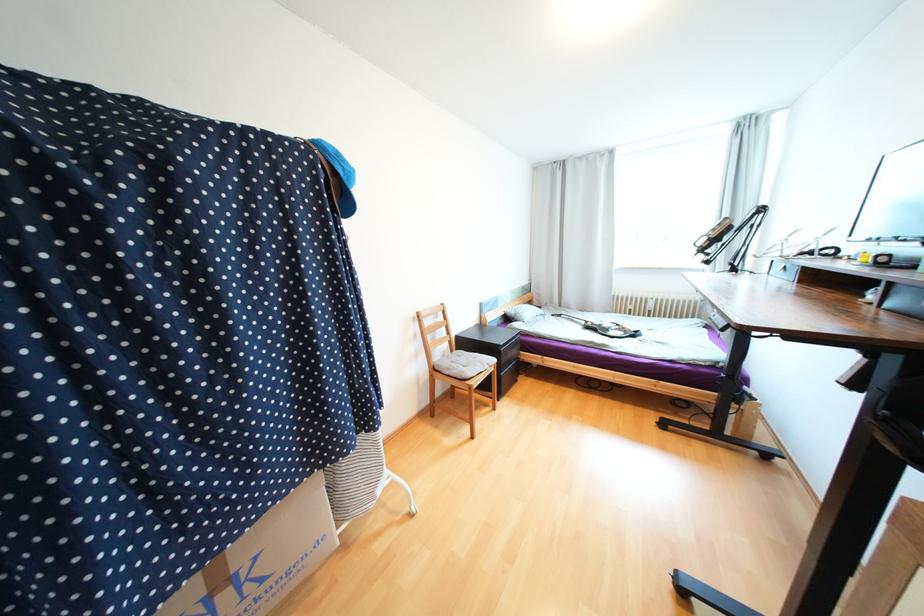
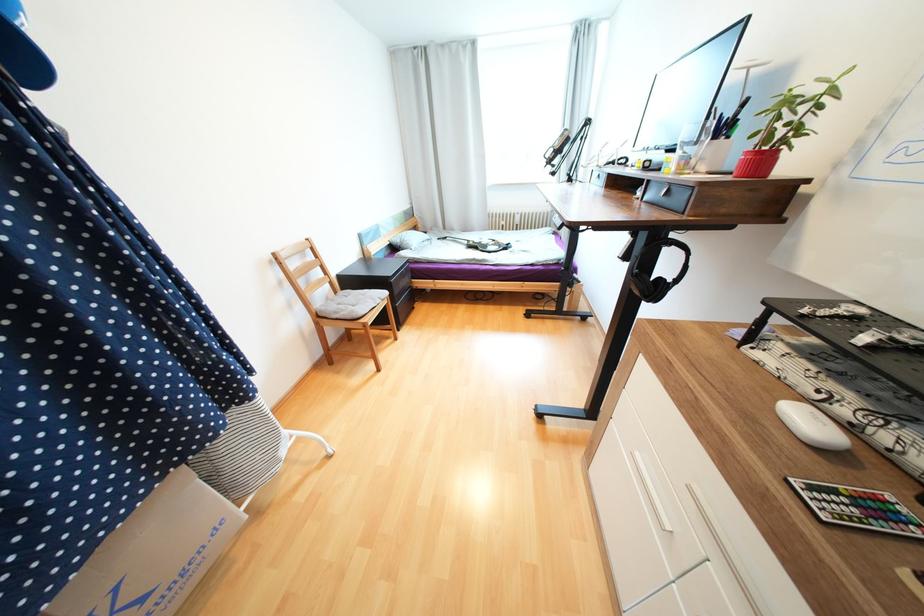
Locate, in the second image, the point that corresponds to (x=355, y=207) in the first image.

(33, 62)